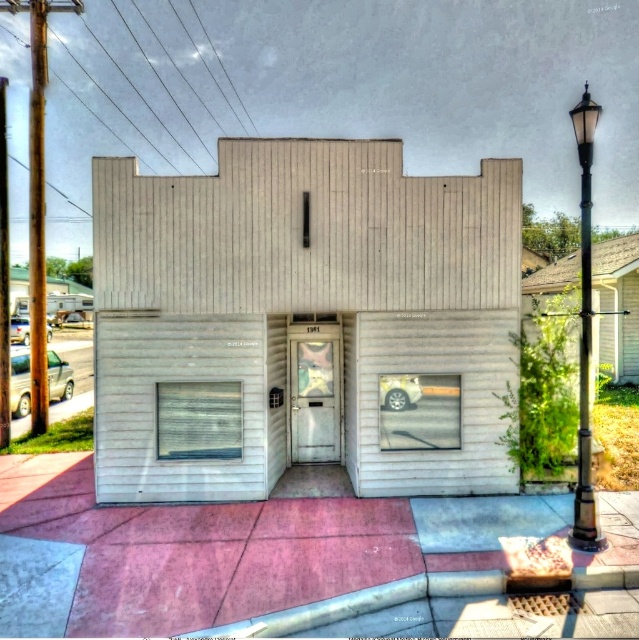
Question: Is wooden utility pole at left to the left of black polished metal streetlight at right from the viewer's perspective?

Choices:
 (A) yes
 (B) no

Answer: (A)

Question: Is wooden utility pole at left further to camera compared to black polished metal streetlight at right?

Choices:
 (A) no
 (B) yes

Answer: (B)

Question: Can you confirm if wooden utility pole at left is positioned to the right of black polished metal streetlight at right?

Choices:
 (A) yes
 (B) no

Answer: (B)

Question: Among these points, which one is nearest to the camera?

Choices:
 (A) (581, 458)
 (B) (29, 320)

Answer: (A)